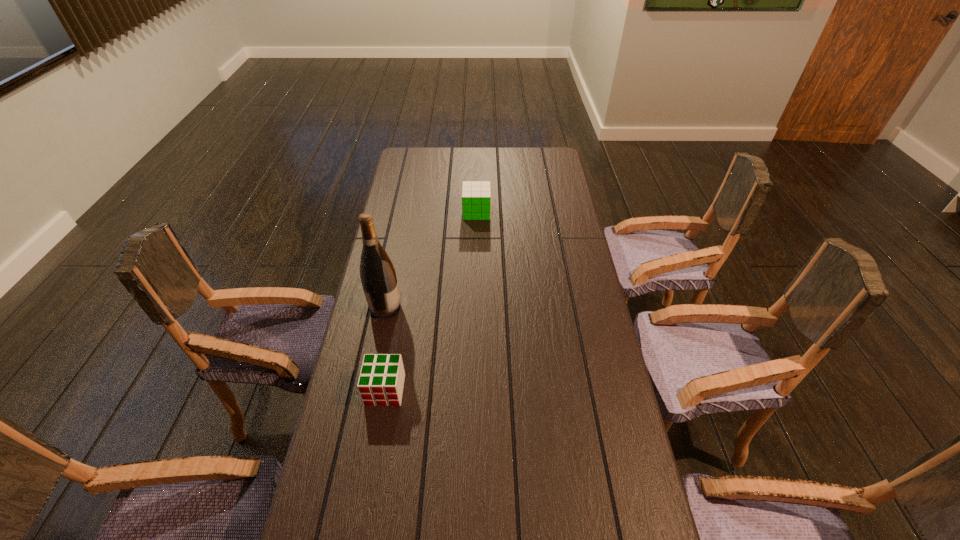
Where is `cube located in the left edge section of the desktop`? This screenshot has height=540, width=960. cube located in the left edge section of the desktop is located at coordinates (381, 381).

In the image, there is a desktop. Identify the location of free region at the far edge. (515, 166).

Locate an element on the screen. Image resolution: width=960 pixels, height=540 pixels. vacant space at the left edge of the desktop is located at coordinates [417, 181].

Find the location of `free location at the right edge of the desktop`. free location at the right edge of the desktop is located at coordinates (572, 468).

At what (x,y) coordinates should I click in order to perform the action: click on free spot at the far left corner of the desktop. Please return your answer as a coordinate pair (x, y). This screenshot has height=540, width=960. Looking at the image, I should click on (411, 157).

Identify the location of vacant area that lies between the tallest object and the right cube. Image resolution: width=960 pixels, height=540 pixels. (431, 260).

In order to click on free area in between the nearer cube and the farther cube in this screenshot , I will do `click(431, 301)`.

Where is `free space between the nearer cube and the tallest object`? Image resolution: width=960 pixels, height=540 pixels. free space between the nearer cube and the tallest object is located at coordinates (385, 349).

Where is `blank region between the rightmost object and the tallest object`? The image size is (960, 540). blank region between the rightmost object and the tallest object is located at coordinates (431, 260).

This screenshot has height=540, width=960. In order to click on free area in between the left cube and the tallest object in this screenshot , I will do `click(385, 349)`.